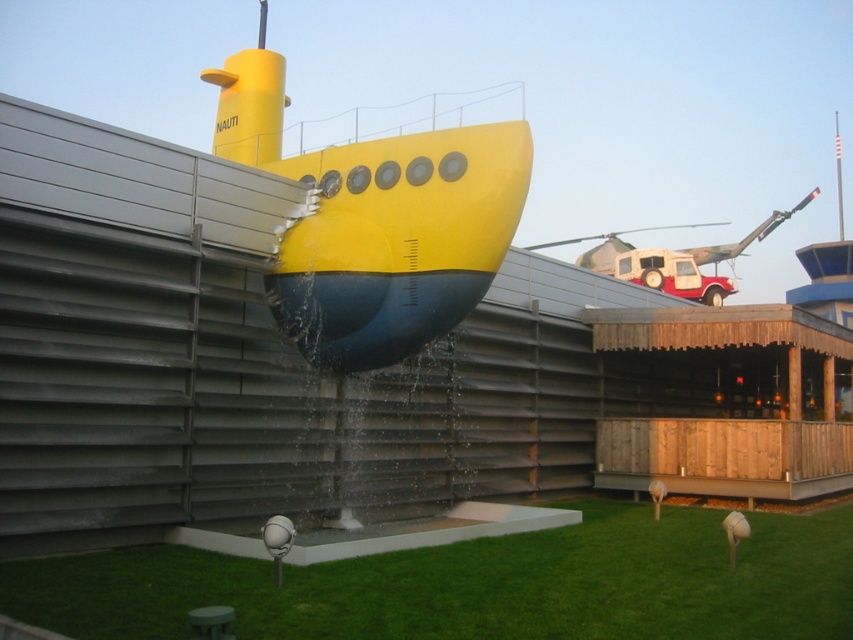
You are standing at the origin point of the coordinate system in the image. Where is the green artificial turf at lower center located?

The green artificial turf at lower center is located at point (477, 584).

You are a landscape architect designing a garden and want to place a new statue between the green artificial turf at lower center and the yellow matte submarine at center. Considering their sizes, which object should the statue be closer to?

The green artificial turf at lower center has a smaller size compared to the yellow matte submarine at center, so the statue should be placed closer to the yellow matte submarine at center to maintain visual balance.